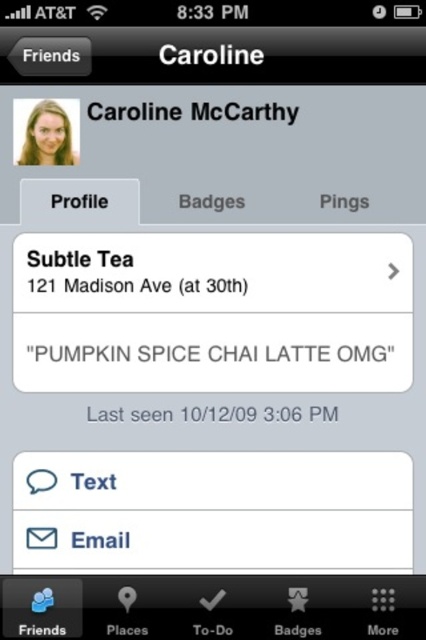
Looking at this image, does matte plastic cup at center have a lesser width compared to matte blonde hair at upper left?

Incorrect, matte plastic cup at center's width is not less than matte blonde hair at upper left's.

Does matte plastic cup at center have a larger size compared to matte blonde hair at upper left?

Yes, matte plastic cup at center is bigger than matte blonde hair at upper left.

You are a GUI agent. You are given a task and a screenshot of the screen. Output one action in this format:
    pyautogui.click(x=<x>, y=<y>)
    Task: Click on the matte plastic cup at center
    The width and height of the screenshot is (426, 640).
    Given the screenshot: What is the action you would take?
    pyautogui.click(x=271, y=268)

In the scene shown: Does matte blonde hair at upper left have a lesser width compared to black matte text at upper center?

Indeed, matte blonde hair at upper left has a lesser width compared to black matte text at upper center.

Is point (62, 134) closer to viewer compared to point (239, 118)?

Yes, point (62, 134) is in front of point (239, 118).

Between point (71, 150) and point (284, 120), which one is positioned behind?

Positioned behind is point (284, 120).

Where is `matte blonde hair at upper left`? This screenshot has width=426, height=640. matte blonde hair at upper left is located at coordinates tap(48, 136).

Who is shorter, matte plastic cup at center or black matte text at upper center?

With less height is black matte text at upper center.

Who is lower down, matte plastic cup at center or black matte text at upper center?

matte plastic cup at center

Image resolution: width=426 pixels, height=640 pixels. What are the coordinates of `matte plastic cup at center` in the screenshot? It's located at (271, 268).